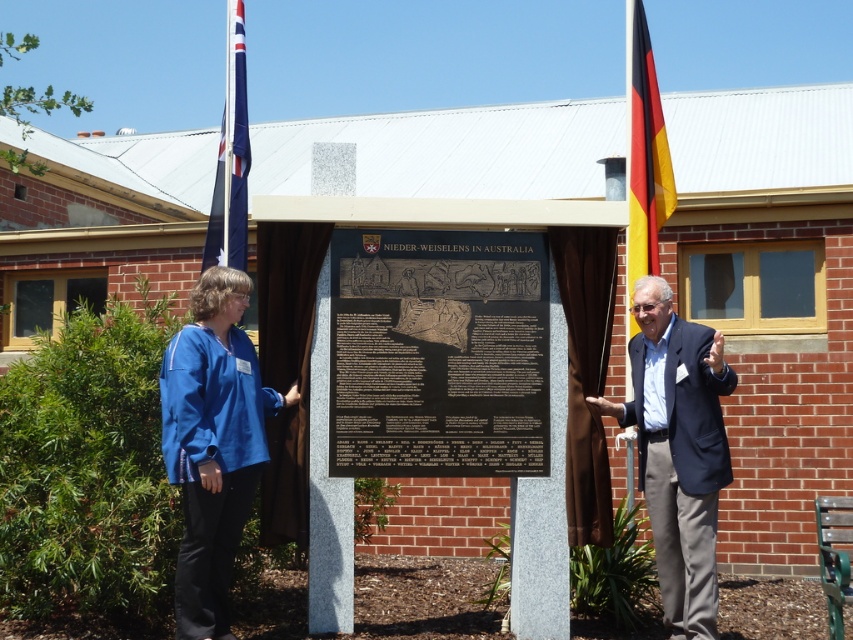
Looking at this image, you are standing at the center of the image. Which direction should you move to get closer to the dark blue suit at right?

Since the dark blue suit at right is located at point 0.703 on the x axis and 0.796 on the y axis, you should move towards the right and slightly upwards to get closer to it.

You are standing at the point closest to the plaque. Which coordinate point, point (201, 372) or point (231, 86), is closer to you?

Point (201, 372) is closer to you because it is in front of point (231, 86).